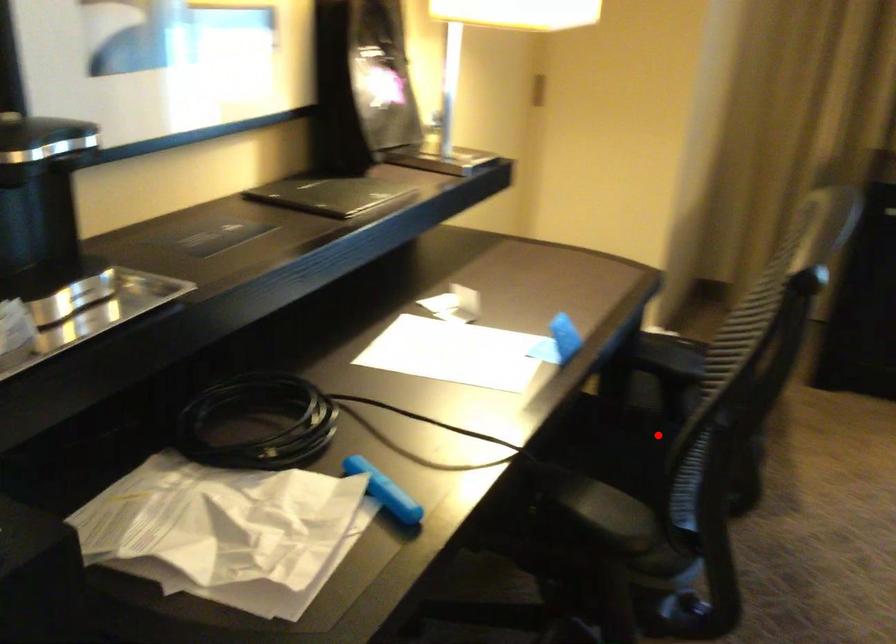
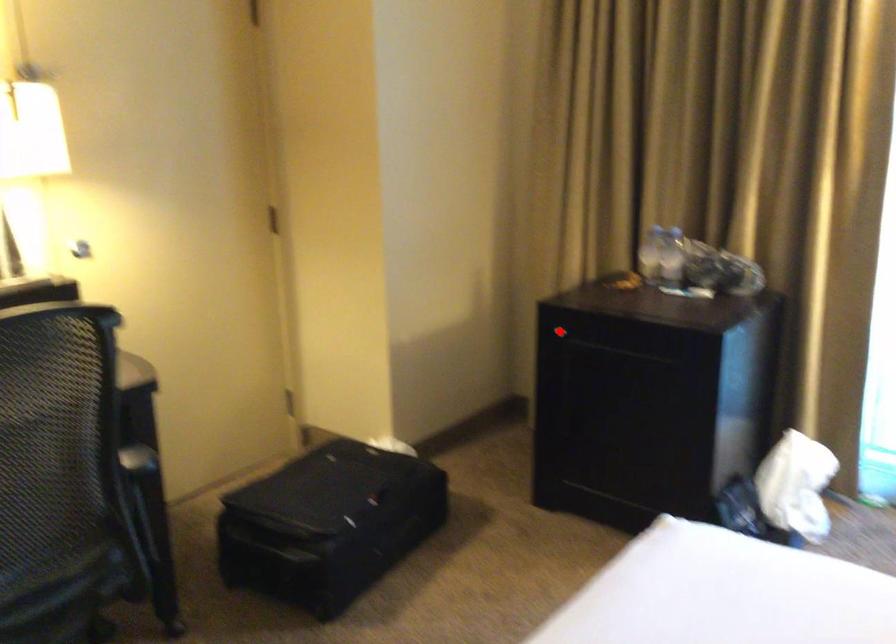
I am providing you with two images of the same scene from different viewpoints. A red point is marked on the first image and another point is marked on the second image. Does the point marked in image1 correspond to the same location as the one in image2?

No